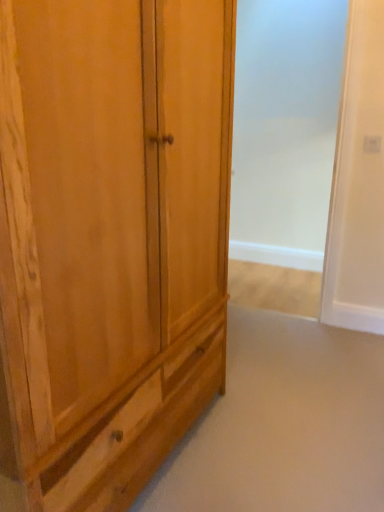
The height and width of the screenshot is (512, 384). What do you see at coordinates (285, 141) in the screenshot?
I see `white glossy screen door at center` at bounding box center [285, 141].

Where is `white glossy screen door at center`? The width and height of the screenshot is (384, 512). white glossy screen door at center is located at coordinates (285, 141).

The height and width of the screenshot is (512, 384). Describe the element at coordinates (110, 240) in the screenshot. I see `natural wood cupboard at left` at that location.

Locate an element on the screen. The width and height of the screenshot is (384, 512). natural wood cupboard at left is located at coordinates (110, 240).

At what (x,y) coordinates should I click in order to perform the action: click on white glossy screen door at center. Please return your answer as a coordinate pair (x, y). The image size is (384, 512). Looking at the image, I should click on (285, 141).

Between white glossy screen door at center and natural wood cupboard at left, which one appears on the left side from the viewer's perspective?

From the viewer's perspective, natural wood cupboard at left appears more on the left side.

Between white glossy screen door at center and natural wood cupboard at left, which one is positioned in front?

natural wood cupboard at left is more forward.

Is point (259, 5) in front of point (29, 364)?

No, it is behind (29, 364).

From the image's perspective, which one is positioned lower, white glossy screen door at center or natural wood cupboard at left?

natural wood cupboard at left appears lower in the image.

From a real-world perspective, which is physically above, white glossy screen door at center or natural wood cupboard at left?

white glossy screen door at center is physically above.

Considering the sizes of objects white glossy screen door at center and natural wood cupboard at left in the image provided, who is wider, white glossy screen door at center or natural wood cupboard at left?

Wider between the two is natural wood cupboard at left.

Considering the relative sizes of white glossy screen door at center and natural wood cupboard at left in the image provided, is white glossy screen door at center shorter than natural wood cupboard at left?

No.

Looking at this image, can you confirm if white glossy screen door at center is smaller than natural wood cupboard at left?

Indeed, white glossy screen door at center has a smaller size compared to natural wood cupboard at left.

Which is correct: white glossy screen door at center is inside natural wood cupboard at left, or outside of it?

white glossy screen door at center is not enclosed by natural wood cupboard at left.

Would you say white glossy screen door at center is a long distance from natural wood cupboard at left?

Yes, white glossy screen door at center and natural wood cupboard at left are quite far apart.

Is white glossy screen door at center oriented away from natural wood cupboard at left?

No, natural wood cupboard at left is not at the back of white glossy screen door at center.

What's the angular difference between white glossy screen door at center and natural wood cupboard at left's facing directions?

89.8 degrees separate the facing orientations of white glossy screen door at center and natural wood cupboard at left.

Measure the distance from white glossy screen door at center to natural wood cupboard at left.

white glossy screen door at center and natural wood cupboard at left are 6.13 feet apart.

Locate an element on the screen. Image resolution: width=384 pixels, height=512 pixels. cupboard lying in front of the white glossy screen door at center is located at coordinates (110, 240).

Considering the positions of objects natural wood cupboard at left and white glossy screen door at center in the image provided, who is more to the right, natural wood cupboard at left or white glossy screen door at center?

Positioned to the right is white glossy screen door at center.

From the picture: Is the depth of natural wood cupboard at left less than that of white glossy screen door at center?

Yes, the depth of natural wood cupboard at left is less than that of white glossy screen door at center.

Is point (202, 322) more distant than point (341, 29)?

No, (202, 322) is closer to viewer.

From the image's perspective, would you say natural wood cupboard at left is positioned over white glossy screen door at center?

Actually, natural wood cupboard at left appears below white glossy screen door at center in the image.

From a real-world perspective, is natural wood cupboard at left positioned above or below white glossy screen door at center?

natural wood cupboard at left is below white glossy screen door at center.

Considering the sizes of objects natural wood cupboard at left and white glossy screen door at center in the image provided, who is thinner, natural wood cupboard at left or white glossy screen door at center?

white glossy screen door at center.

Considering the sizes of objects natural wood cupboard at left and white glossy screen door at center in the image provided, who is shorter, natural wood cupboard at left or white glossy screen door at center?

natural wood cupboard at left.

Can you confirm if natural wood cupboard at left is bigger than white glossy screen door at center?

Indeed, natural wood cupboard at left has a larger size compared to white glossy screen door at center.

Is natural wood cupboard at left not inside white glossy screen door at center?

natural wood cupboard at left lies outside white glossy screen door at center's area.

Is natural wood cupboard at left next to white glossy screen door at center?

No, natural wood cupboard at left is not touching white glossy screen door at center.

Is natural wood cupboard at left oriented away from white glossy screen door at center?

No, white glossy screen door at center is not at the back of natural wood cupboard at left.

There is a natural wood cupboard at left. Where is `screen door above it (from a real-world perspective)`? The width and height of the screenshot is (384, 512). screen door above it (from a real-world perspective) is located at coordinates (285, 141).

Image resolution: width=384 pixels, height=512 pixels. I want to click on cupboard that is under the white glossy screen door at center (from a real-world perspective), so click(110, 240).

Where is `screen door that appears above the natural wood cupboard at left (from the image's perspective)`? screen door that appears above the natural wood cupboard at left (from the image's perspective) is located at coordinates (285, 141).